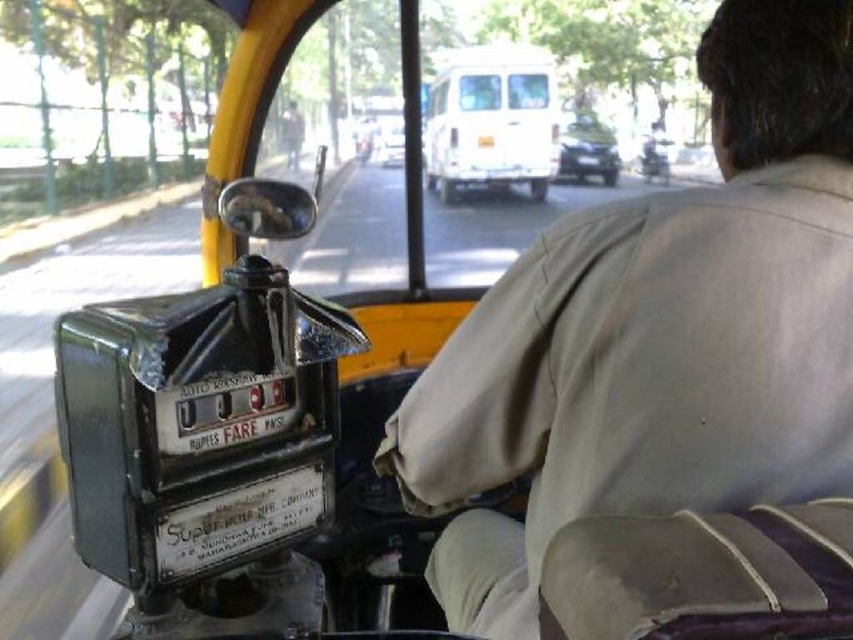
Can you confirm if metallic silver car at center is positioned to the left of shiny metallic motorcycle at center?

Yes, metallic silver car at center is to the left of shiny metallic motorcycle at center.

Is point (595, 145) closer to viewer compared to point (650, 172)?

Yes, it is in front of point (650, 172).

Is point (572, 170) more distant than point (647, 147)?

No, (572, 170) is in front of (647, 147).

I want to click on metallic silver car at center, so click(x=587, y=148).

Is beige fabric shirt at upper right bigger than white matte bus at center?

Yes, beige fabric shirt at upper right is bigger than white matte bus at center.

Does beige fabric shirt at upper right have a smaller size compared to white matte bus at center?

Incorrect, beige fabric shirt at upper right is not smaller in size than white matte bus at center.

Does point (726, 321) come in front of point (543, 124)?

Yes.

This screenshot has width=853, height=640. I want to click on beige fabric shirt at upper right, so click(657, 333).

Is white matte bus at center shorter than shiny metallic motorcycle at center?

No.

The image size is (853, 640). I want to click on white matte bus at center, so click(x=491, y=120).